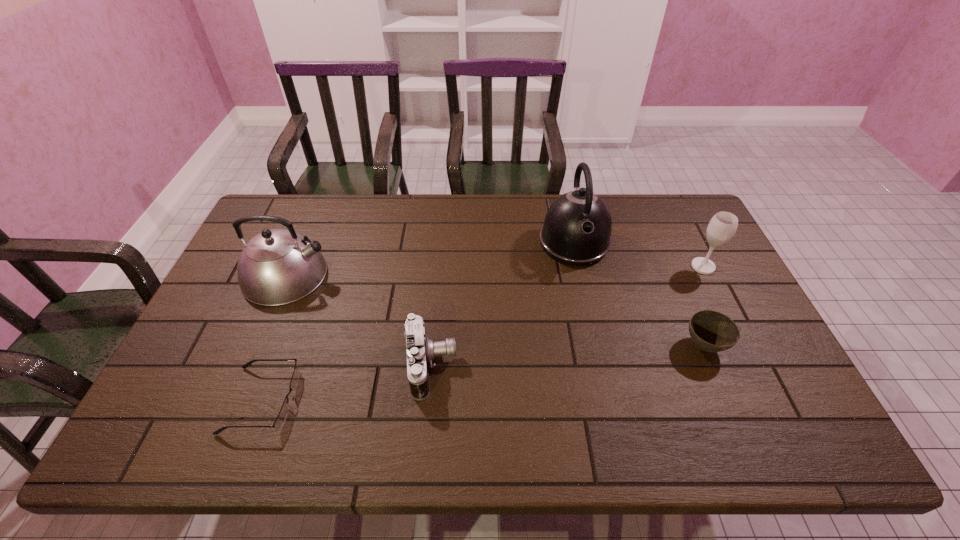
Locate an element on the screen. Image resolution: width=960 pixels, height=540 pixels. the third object from right to left is located at coordinates (577, 228).

Identify the location of the tallest object. tap(577, 228).

I want to click on the shorter kettle, so click(x=278, y=266).

The image size is (960, 540). In order to click on wineglass in this screenshot , I will do (723, 225).

This screenshot has width=960, height=540. I want to click on the fourth shortest object, so click(x=723, y=225).

Where is `the fourth tallest object`? The height and width of the screenshot is (540, 960). the fourth tallest object is located at coordinates coord(421,351).

Image resolution: width=960 pixels, height=540 pixels. Identify the location of the third object from left to right. (421, 351).

Identify the location of the second object from right to left. (711, 331).

Identify the location of the second shortest object. Image resolution: width=960 pixels, height=540 pixels. (711, 331).

Where is `spectacles`? The width and height of the screenshot is (960, 540). spectacles is located at coordinates (282, 416).